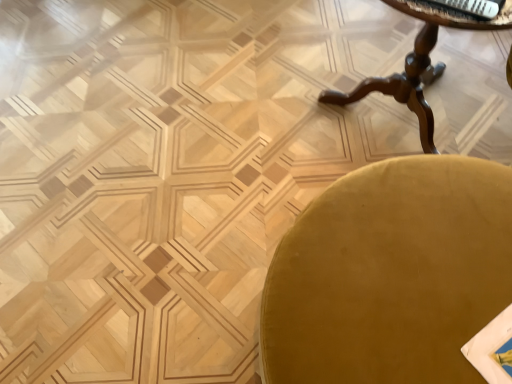
Where is `vacant region to the left of mahogany wood table at upper right`? The image size is (512, 384). vacant region to the left of mahogany wood table at upper right is located at coordinates coord(249,138).